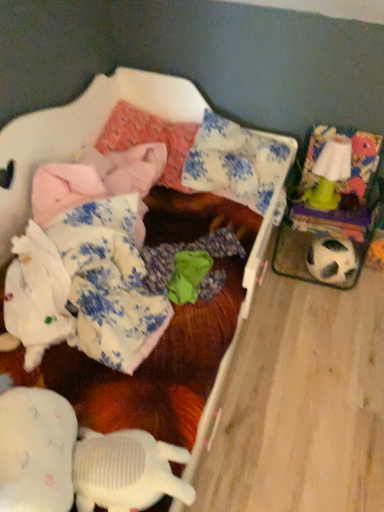
Question: From the image's perspective, is blue floral fabric pillow at center, which is the second pillow from left to right, on white fabric at lower left, the 2th clothing from the right?

Choices:
 (A) no
 (B) yes

Answer: (B)

Question: From a real-world perspective, is blue floral fabric pillow at center, which is the second pillow from left to right, on white fabric at lower left, positioned as the first clothing in left-to-right order?

Choices:
 (A) no
 (B) yes

Answer: (B)

Question: Are blue floral fabric pillow at center, marked as the 1th pillow in a right-to-left arrangement, and white fabric at lower left, the 2th clothing from the right, located far from each other?

Choices:
 (A) no
 (B) yes

Answer: (A)

Question: Considering the relative sizes of blue floral fabric pillow at center, marked as the 1th pillow in a right-to-left arrangement, and white fabric at lower left, positioned as the first clothing in left-to-right order, in the image provided, is blue floral fabric pillow at center, marked as the 1th pillow in a right-to-left arrangement, taller than white fabric at lower left, positioned as the first clothing in left-to-right order,?

Choices:
 (A) yes
 (B) no

Answer: (A)

Question: Considering the relative sizes of blue floral fabric pillow at center, marked as the 1th pillow in a right-to-left arrangement, and white fabric at lower left, positioned as the first clothing in left-to-right order, in the image provided, is blue floral fabric pillow at center, marked as the 1th pillow in a right-to-left arrangement, smaller than white fabric at lower left, positioned as the first clothing in left-to-right order,?

Choices:
 (A) yes
 (B) no

Answer: (B)

Question: Is blue floral fabric pillow at center, marked as the 1th pillow in a right-to-left arrangement, at the right side of white fabric at lower left, the 2th clothing from the right?

Choices:
 (A) no
 (B) yes

Answer: (B)

Question: From the image's perspective, is white fabric at lower left, the 2th clothing from the right, under black and white textured football at right?

Choices:
 (A) yes
 (B) no

Answer: (A)

Question: Considering the relative positions of white fabric at lower left, the 2th clothing from the right, and black and white textured football at right in the image provided, is white fabric at lower left, the 2th clothing from the right, to the right of black and white textured football at right from the viewer's perspective?

Choices:
 (A) no
 (B) yes

Answer: (A)

Question: Considering the relative positions of white fabric at lower left, the 2th clothing from the right, and black and white textured football at right in the image provided, is white fabric at lower left, the 2th clothing from the right, in front of black and white textured football at right?

Choices:
 (A) yes
 (B) no

Answer: (A)

Question: From a real-world perspective, is white fabric at lower left, the 2th clothing from the right, physically above black and white textured football at right?

Choices:
 (A) no
 (B) yes

Answer: (B)

Question: Can you confirm if white fabric at lower left, positioned as the first clothing in left-to-right order, is taller than black and white textured football at right?

Choices:
 (A) yes
 (B) no

Answer: (A)

Question: Does white fabric at lower left, positioned as the first clothing in left-to-right order, have a smaller size compared to black and white textured football at right?

Choices:
 (A) no
 (B) yes

Answer: (A)

Question: Is fluffy pink blanket at upper left positioned beyond the bounds of green plastic lamp at upper right?

Choices:
 (A) yes
 (B) no

Answer: (A)